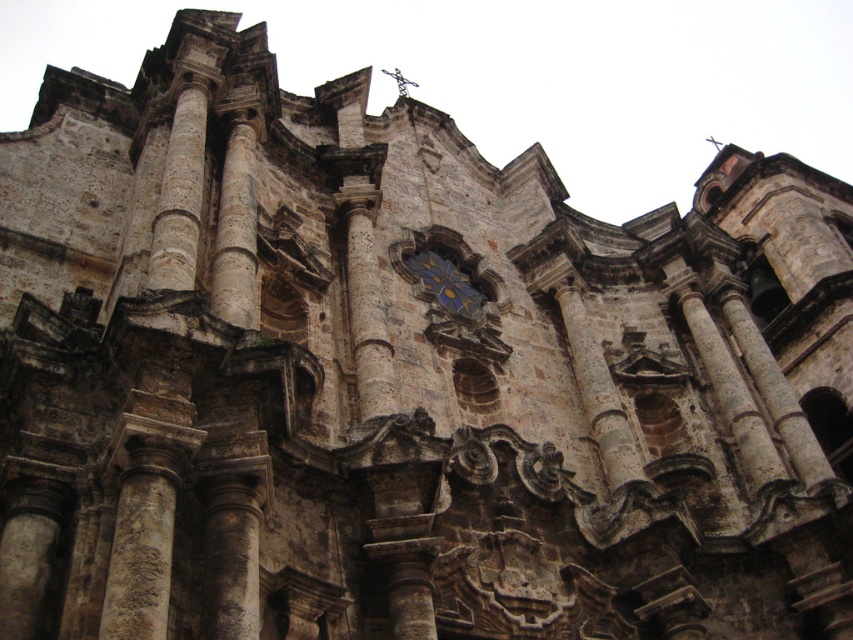
Is stone column at center taller than blue glass mosaic at center?

Indeed, stone column at center has a greater height compared to blue glass mosaic at center.

In the scene shown: Can you confirm if stone column at center is bigger than blue glass mosaic at center?

Correct, stone column at center is larger in size than blue glass mosaic at center.

Between point (178, 188) and point (473, 300), which one is positioned in front?

Point (178, 188) is in front.

You are a GUI agent. You are given a task and a screenshot of the screen. Output one action in this format:
    pyautogui.click(x=<x>, y=<y>)
    Task: Click on the stone column at center
    The image size is (853, 640).
    Given the screenshot: What is the action you would take?
    pyautogui.click(x=180, y=193)